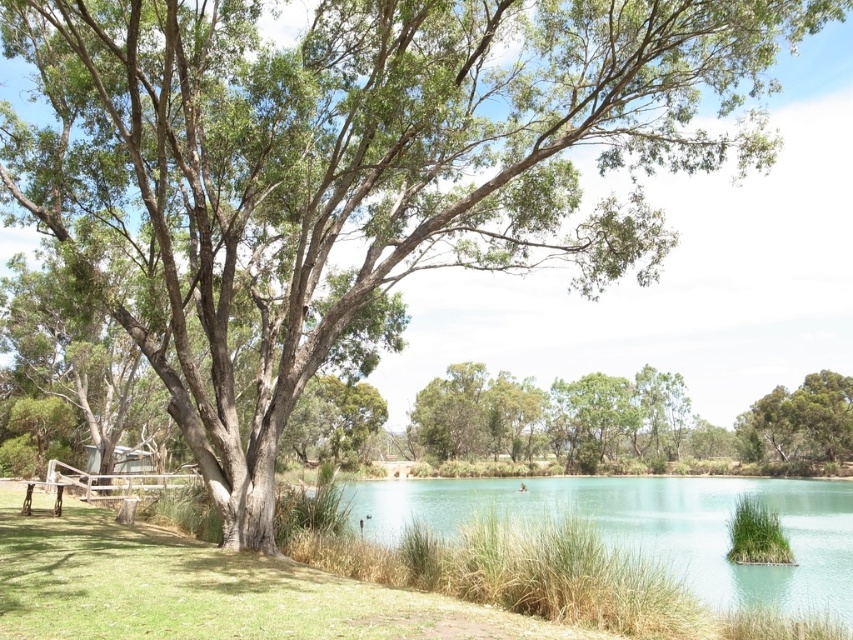
Question: Is clear blue water at center below green grass at lower right?

Choices:
 (A) yes
 (B) no

Answer: (A)

Question: Is clear blue water at center positioned in front of green leafy tree at center?

Choices:
 (A) yes
 (B) no

Answer: (A)

Question: In this image, where is clear blue water at center located relative to green leafy tree at center?

Choices:
 (A) left
 (B) right

Answer: (A)

Question: Which point is farther to the camera?

Choices:
 (A) clear blue water at center
 (B) green leafy tree at center

Answer: (B)

Question: Based on their relative distances, which object is farther from the green leafy tree at center?

Choices:
 (A) green grass at lower right
 (B) clear blue water at center

Answer: (A)

Question: Which object is farther from the camera taking this photo?

Choices:
 (A) green grass at lower right
 (B) clear blue water at center
 (C) green leafy tree at center

Answer: (C)